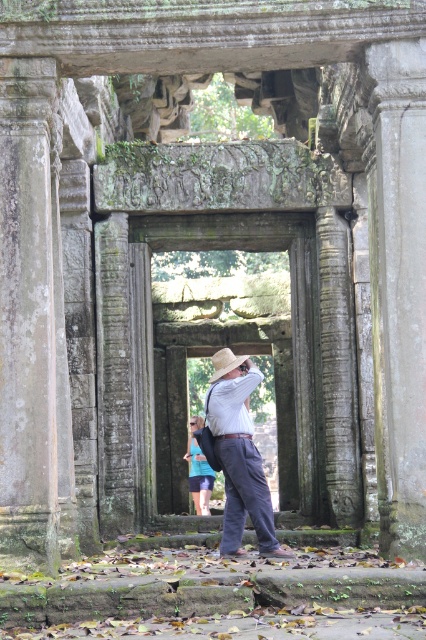
At what (x,y) coordinates should I click in order to perform the action: click on light brown straw hat at center. Please return your answer as a coordinate pair (x, y). This screenshot has width=426, height=640. Looking at the image, I should click on (239, 454).

Is light brown straw hat at center below natural straw cowboy hat at center?

Yes, light brown straw hat at center is below natural straw cowboy hat at center.

You are a GUI agent. You are given a task and a screenshot of the screen. Output one action in this format:
    pyautogui.click(x=<x>, y=<y>)
    Task: Click on the light brown straw hat at center
    
    Given the screenshot: What is the action you would take?
    pyautogui.click(x=239, y=454)

Does point (238, 378) come in front of point (201, 496)?

Yes, it is.

Identify the location of light brown straw hat at center. (239, 454).

Consider the image. Measure the distance between blue fabric dress at center and camera.

They are 79.83 meters apart.

Is blue fabric dress at center smaller than natural straw cowboy hat at center?

Indeed, blue fabric dress at center has a smaller size compared to natural straw cowboy hat at center.

Is point (210, 468) behind point (221, 376)?

Yes.

Identify the location of blue fabric dress at center. (198, 468).